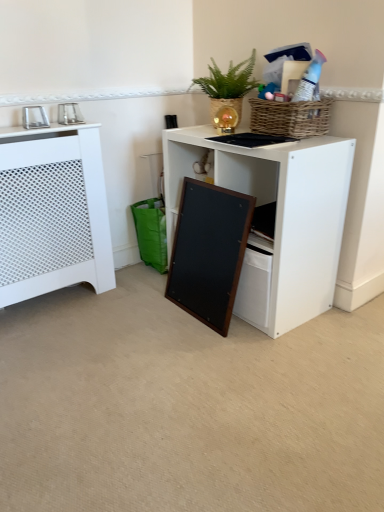
Question: Considering the relative sizes of metallic silver photo frame at upper left, the first appliance viewed from the left, and wooden frame at lower center in the image provided, is metallic silver photo frame at upper left, the first appliance viewed from the left, smaller than wooden frame at lower center?

Choices:
 (A) yes
 (B) no

Answer: (A)

Question: Considering the relative positions of metallic silver photo frame at upper left, the 2th appliance viewed from the right, and wooden frame at lower center in the image provided, is metallic silver photo frame at upper left, the 2th appliance viewed from the right, to the left of wooden frame at lower center from the viewer's perspective?

Choices:
 (A) yes
 (B) no

Answer: (A)

Question: Does metallic silver photo frame at upper left, the 2th appliance viewed from the right, appear on the right side of wooden frame at lower center?

Choices:
 (A) no
 (B) yes

Answer: (A)

Question: Is metallic silver photo frame at upper left, the 2th appliance viewed from the right, positioned before wooden frame at lower center?

Choices:
 (A) yes
 (B) no

Answer: (B)

Question: Is wooden frame at lower center at the back of metallic silver photo frame at upper left, the first appliance viewed from the left?

Choices:
 (A) yes
 (B) no

Answer: (B)

Question: Is metallic silver photo frame at upper left, the first appliance viewed from the left, situated inside metallic silver photo frame at upper left, the 2th appliance when ordered from left to right, or outside?

Choices:
 (A) inside
 (B) outside

Answer: (B)

Question: Looking at the image, does metallic silver photo frame at upper left, the first appliance viewed from the left, seem bigger or smaller compared to metallic silver photo frame at upper left, which is the first appliance from right to left?

Choices:
 (A) big
 (B) small

Answer: (A)

Question: From a real-world perspective, is metallic silver photo frame at upper left, the first appliance viewed from the left, physically located above or below metallic silver photo frame at upper left, which is the first appliance from right to left?

Choices:
 (A) below
 (B) above

Answer: (A)

Question: In the image, is metallic silver photo frame at upper left, the 2th appliance viewed from the right, on the left side or the right side of metallic silver photo frame at upper left, the 2th appliance when ordered from left to right?

Choices:
 (A) left
 (B) right

Answer: (A)

Question: Considering the positions of green woven basket at upper center and white matte desk at center in the image, is green woven basket at upper center taller or shorter than white matte desk at center?

Choices:
 (A) short
 (B) tall

Answer: (A)

Question: Is green woven basket at upper center to the left or to the right of white matte desk at center in the image?

Choices:
 (A) left
 (B) right

Answer: (A)

Question: In the image, is green woven basket at upper center positioned in front of or behind white matte desk at center?

Choices:
 (A) behind
 (B) front

Answer: (A)

Question: Choose the correct answer: Is green woven basket at upper center inside white matte desk at center or outside it?

Choices:
 (A) inside
 (B) outside

Answer: (B)

Question: Is metallic silver photo frame at upper left, the 2th appliance when ordered from left to right, bigger or smaller than white matte desk at center?

Choices:
 (A) small
 (B) big

Answer: (A)

Question: From a real-world perspective, is metallic silver photo frame at upper left, which is the first appliance from right to left, physically located above or below white matte desk at center?

Choices:
 (A) above
 (B) below

Answer: (A)